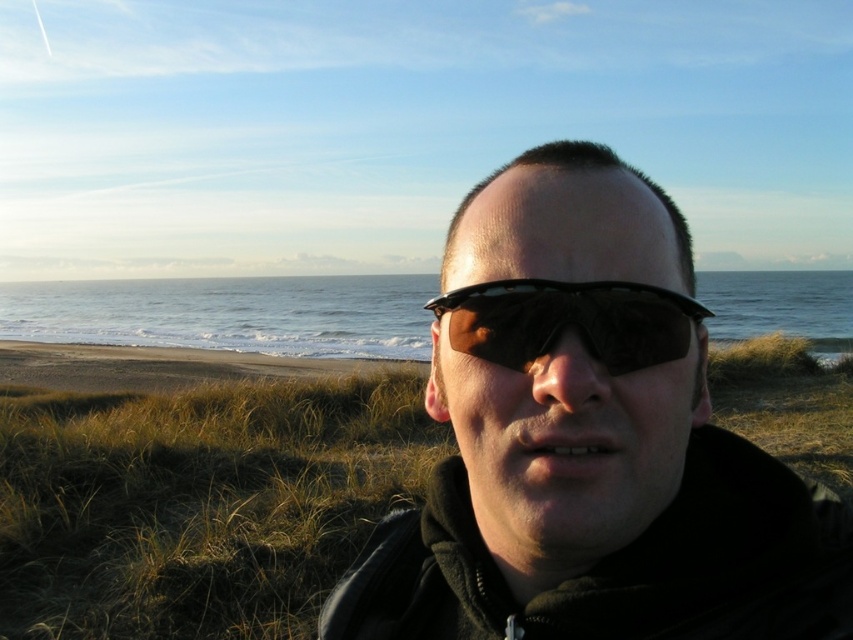
You are a photographer setting up a shot of the beach scene. You notice the brown grass at lower center and the black reflective sunglasses at center. Which object takes up more space horizontally in the frame?

The brown grass at lower center takes up more space horizontally in the frame because its width is larger than that of the black reflective sunglasses at center.

You are a photographer trying to capture the perfect shot of the person wearing matte black sunglasses at center. You notice a bright light source at point (589, 449). To avoid overexposure, should you adjust your camera settings to block light coming from the direction of the matte black sunglasses at center?

The point (589, 449) corresponds to the matte black sunglasses at center, so yes, adjusting the camera settings to block light from that direction would help prevent overexposure caused by the bright light reflecting off the sunglasses.

You are standing at the beach and see two points marked on the ground. The first is at point (68, 529) and the second at point (59, 301). If you want to walk towards the ocean, which point should you step on first?

Point (68, 529) is in front of point (59, 301), so you should step on point (68, 529) first to head towards the ocean.